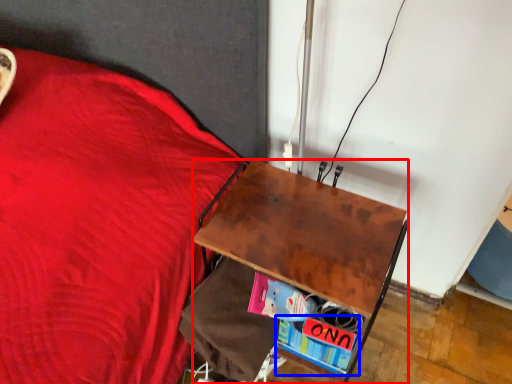
Question: Which object is further to the camera taking this photo, desk (highlighted by a red box) or paperback book (highlighted by a blue box)?

Choices:
 (A) desk
 (B) paperback book

Answer: (B)